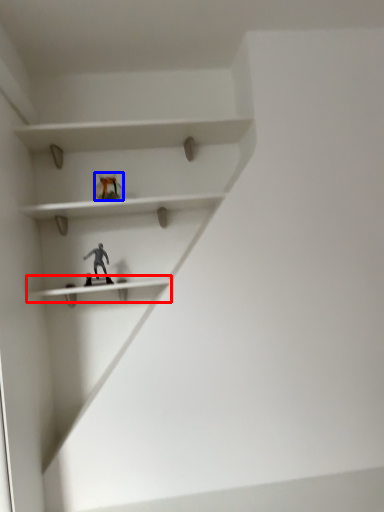
Question: Among these objects, which one is farthest to the camera, shelf (highlighted by a red box) or toy (highlighted by a blue box)?

Choices:
 (A) shelf
 (B) toy

Answer: (B)